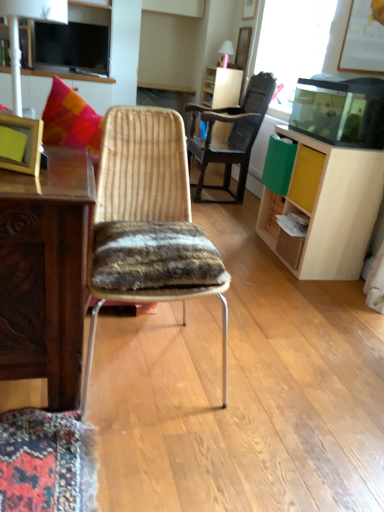
Question: Considering the relative sizes of matte white lamp at upper left and light wood cabinet at right in the image provided, is matte white lamp at upper left wider than light wood cabinet at right?

Choices:
 (A) yes
 (B) no

Answer: (B)

Question: From the image's perspective, is matte white lamp at upper left on light wood cabinet at right?

Choices:
 (A) no
 (B) yes

Answer: (B)

Question: Can you confirm if matte white lamp at upper left is bigger than light wood cabinet at right?

Choices:
 (A) no
 (B) yes

Answer: (A)

Question: Is matte white lamp at upper left outside of light wood cabinet at right?

Choices:
 (A) yes
 (B) no

Answer: (A)

Question: Is matte white lamp at upper left shorter than light wood cabinet at right?

Choices:
 (A) no
 (B) yes

Answer: (B)

Question: From the image's perspective, is wooden picture frame at left above or below light wood drawer at right?

Choices:
 (A) below
 (B) above

Answer: (A)

Question: Is point (13, 129) closer or farther from the camera than point (302, 201)?

Choices:
 (A) closer
 (B) farther

Answer: (A)

Question: Considering the relative positions of wooden picture frame at left and light wood drawer at right in the image provided, is wooden picture frame at left to the left or to the right of light wood drawer at right?

Choices:
 (A) right
 (B) left

Answer: (B)

Question: Considering the positions of wooden picture frame at left and light wood drawer at right in the image, is wooden picture frame at left taller or shorter than light wood drawer at right?

Choices:
 (A) tall
 (B) short

Answer: (B)

Question: From a real-world perspective, is woven wood chair at center, positioned as the 2th chair in bottom-to-top order, above or below matte white lamp at upper left?

Choices:
 (A) below
 (B) above

Answer: (A)

Question: In the image, is woven wood chair at center, which is counted as the 1th chair, starting from the back, on the left side or the right side of matte white lamp at upper left?

Choices:
 (A) right
 (B) left

Answer: (A)

Question: Considering the positions of woven wood chair at center, positioned as the 2th chair in bottom-to-top order, and matte white lamp at upper left in the image, is woven wood chair at center, positioned as the 2th chair in bottom-to-top order, wider or thinner than matte white lamp at upper left?

Choices:
 (A) thin
 (B) wide

Answer: (B)

Question: Is point (266, 77) closer or farther from the camera than point (59, 7)?

Choices:
 (A) closer
 (B) farther

Answer: (A)

Question: Does point (19, 125) appear closer or farther from the camera than point (19, 0)?

Choices:
 (A) closer
 (B) farther

Answer: (A)

Question: Is wooden picture frame at left in front of or behind matte white lamp at upper left in the image?

Choices:
 (A) behind
 (B) front

Answer: (A)